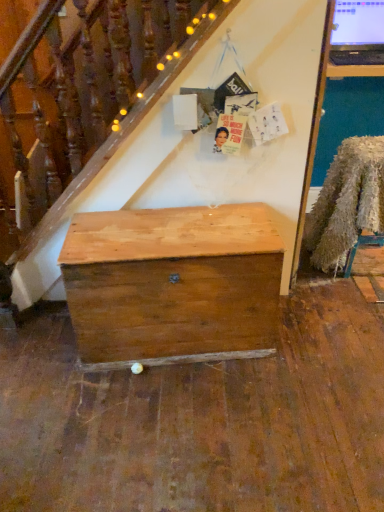
I want to click on free space above natural wood chest at center (from a real-world perspective), so click(x=178, y=230).